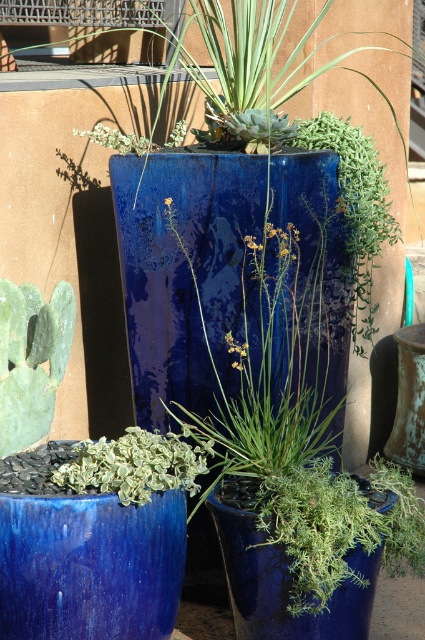
You are standing in the garden and want to water the green matte cactus at lower left. If you are currently 2 meters away from it, how much farther do you need to walk to reach it?

The green matte cactus at lower left and viewer are 3.42 meters apart. Since you are currently 2 meters away, you need to walk an additional 1.42 meters to reach it.

You are a gardener who wants to water the plants. You have a watering can in your left hand and a spray bottle in your right hand. You need to reach both the green matte cactus at lower left and the green variegated leaf at center. Which plant should you water first to avoid getting the spray bottle wet from the other plant?

You should water the green variegated leaf at center first because it is behind the green matte cactus at lower left. Watering the one in front first might splash water onto the spray bottle held in your right hand when you reach for the back plant.

You are a gardener who wants to place a new small plant between the green matte cactus at lower left and the green variegated leaf at center. Can you do this without moving either of them?

The green matte cactus at lower left is positioned on the left side of green variegated leaf at center, so there is space between them to place a new small plant without moving either of them.